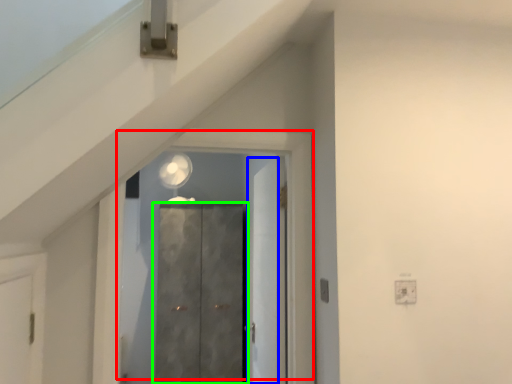
Question: Which object is the farthest from door (highlighted by a red box)? Choose among these: door (highlighted by a blue box) or door (highlighted by a green box).

Choices:
 (A) door
 (B) door

Answer: (B)